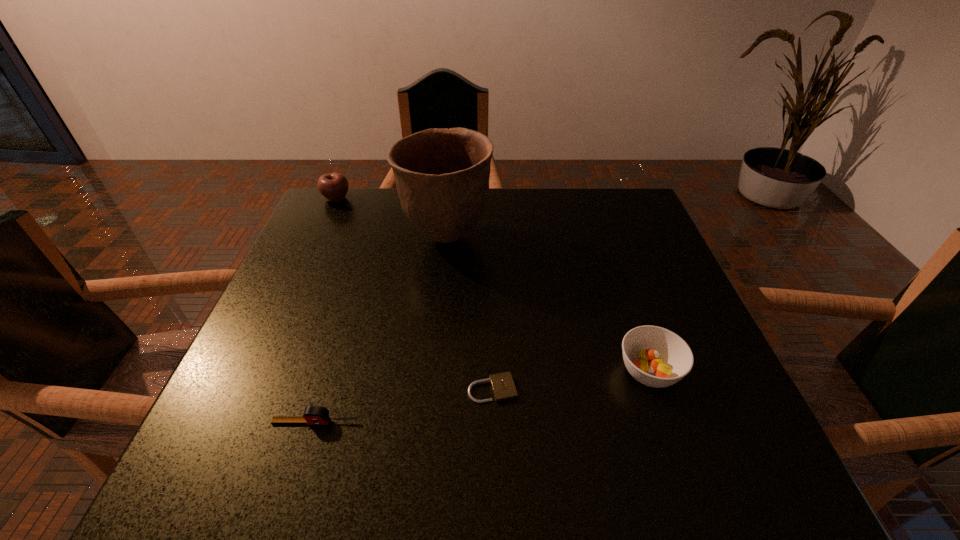
Locate an element on the screen. The height and width of the screenshot is (540, 960). vacant space that satisfies the following two spatial constraints: 1. on the side of the shortest object with the unique marking; 2. on the left side of the fourth shortest object is located at coordinates (251, 389).

At what (x,y) coordinates should I click in order to perform the action: click on vacant space that satisfies the following two spatial constraints: 1. on the side of the second farthest object with the unique marking; 2. on the right side of the apple. Please return your answer as a coordinate pair (x, y). The height and width of the screenshot is (540, 960). Looking at the image, I should click on (319, 237).

This screenshot has width=960, height=540. Identify the location of vacant space that satisfies the following two spatial constraints: 1. on the side of the soup bowl with the unique marking; 2. on the left side of the leftmost object. (258, 372).

Identify the location of vacant space that satisfies the following two spatial constraints: 1. on the back side of the soup bowl; 2. on the side of the farthest object with the unique marking. (589, 198).

Find the location of `free location that satisfies the following two spatial constraints: 1. on the side of the second tallest object with the unique marking; 2. on the right side of the padlock`. free location that satisfies the following two spatial constraints: 1. on the side of the second tallest object with the unique marking; 2. on the right side of the padlock is located at coordinates coord(251,389).

This screenshot has width=960, height=540. Identify the location of free space that satisfies the following two spatial constraints: 1. on the side of the leftmost object with the unique marking; 2. on the left side of the tallest object. (319, 237).

Where is `vacant area that satisfies the following two spatial constraints: 1. on the side of the second tallest object with the unique marking; 2. on the left side of the pottery`? The width and height of the screenshot is (960, 540). vacant area that satisfies the following two spatial constraints: 1. on the side of the second tallest object with the unique marking; 2. on the left side of the pottery is located at coordinates (319, 237).

Locate an element on the screen. vacant region that satisfies the following two spatial constraints: 1. on the side of the farthest object with the unique marking; 2. on the left side of the third tallest object is located at coordinates pos(258,372).

The width and height of the screenshot is (960, 540). Identify the location of blank space that satisfies the following two spatial constraints: 1. on the side of the apple with the unique marking; 2. on the right side of the soup bowl. (258, 372).